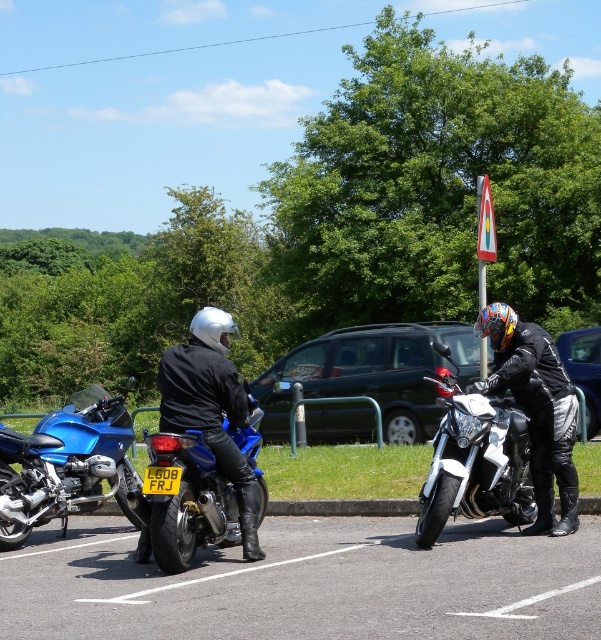
Is point (487, 449) more distant than point (522, 401)?

No, it is in front of (522, 401).

Who is lower down, white glossy motorcycle at center or matte black motorcycle at right?

Positioned lower is white glossy motorcycle at center.

From the picture: Measure the distance between white glossy motorcycle at center and camera.

white glossy motorcycle at center and camera are 7.30 meters apart.

Identify the location of white glossy motorcycle at center. The height and width of the screenshot is (640, 601). (475, 461).

Does black rubber motorcycle at lower center lie behind blue metallic motorcycle at center?

That is False.

Consider the image. Does black rubber motorcycle at lower center appear under blue metallic motorcycle at center?

Correct, black rubber motorcycle at lower center is located below blue metallic motorcycle at center.

I want to click on black rubber motorcycle at lower center, so click(310, 582).

Is blue metallic motorcycle at left positioned at the back of matte black motorcycle at right?

Yes, blue metallic motorcycle at left is behind matte black motorcycle at right.

Is point (49, 445) less distant than point (545, 380)?

No.

This screenshot has height=640, width=601. What are the coordinates of `blue metallic motorcycle at left` in the screenshot? It's located at (66, 465).